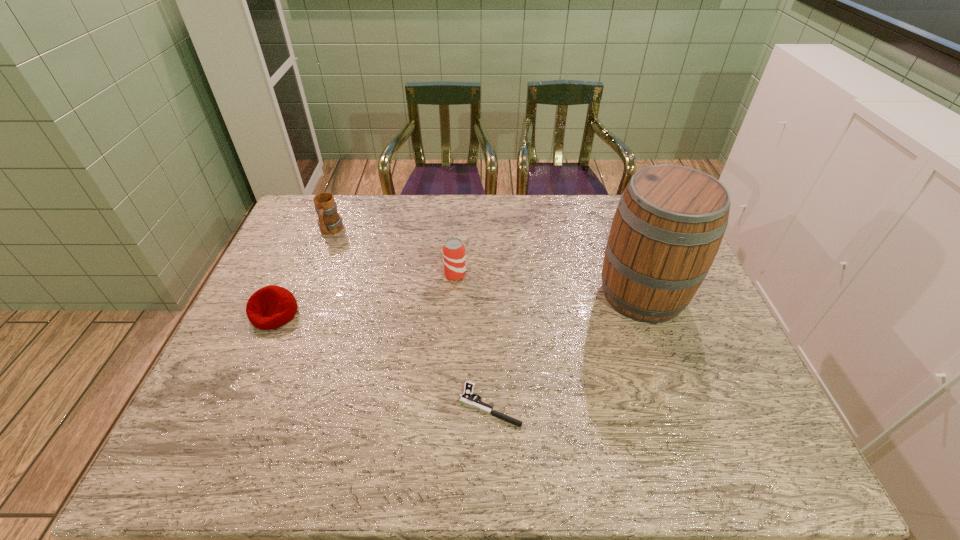
Where is `free spot between the shortest object and the beanbag`? Image resolution: width=960 pixels, height=540 pixels. free spot between the shortest object and the beanbag is located at coordinates (382, 359).

Where is `vacant space that is in between the pistol and the second shortest object`? vacant space that is in between the pistol and the second shortest object is located at coordinates (382, 359).

Image resolution: width=960 pixels, height=540 pixels. What are the coordinates of `empty location between the beer can and the shortest object` in the screenshot? It's located at (472, 340).

This screenshot has width=960, height=540. Identify the location of vacant space that's between the nearest object and the mug. (410, 318).

The width and height of the screenshot is (960, 540). Identify the location of vacant point located between the pistol and the beanbag. (382, 359).

Find the location of `free spot between the tallest object and the mug`. free spot between the tallest object and the mug is located at coordinates (487, 262).

Select which object appears as the closest to the pistol. Please provide its 2D coordinates. Your answer should be formatted as a tuple, i.e. [(x, y)], where the tuple contains the x and y coordinates of a point satisfying the conditions above.

[(670, 221)]

Where is `the third closest object to the nearest object`? This screenshot has width=960, height=540. the third closest object to the nearest object is located at coordinates (271, 307).

The height and width of the screenshot is (540, 960). In order to click on vacant space that satisfies the following two spatial constraints: 1. on the side of the beer can with the handle; 2. on the left side of the mug in this screenshot , I will do `click(313, 274)`.

This screenshot has width=960, height=540. I want to click on vacant point that satisfies the following two spatial constraints: 1. on the side of the beer can with the handle; 2. on the left side of the mug, so click(x=313, y=274).